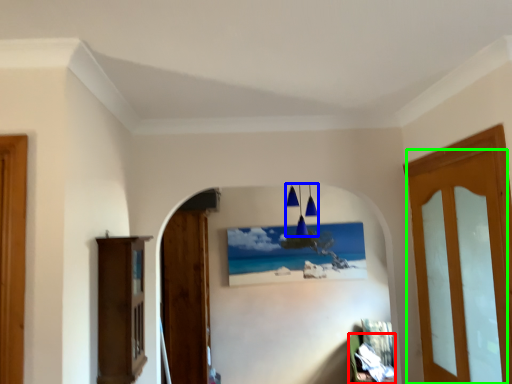
Question: Based on their relative distances, which object is farther from furniture (highlighted by a red box)? Choose from lamp (highlighted by a blue box) and door (highlighted by a green box).

Choices:
 (A) lamp
 (B) door

Answer: (B)